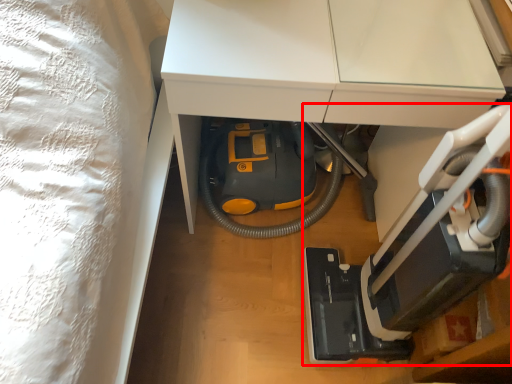
Question: In this image, where is equipment (annotated by the red box) located relative to furniture?

Choices:
 (A) left
 (B) right

Answer: (B)